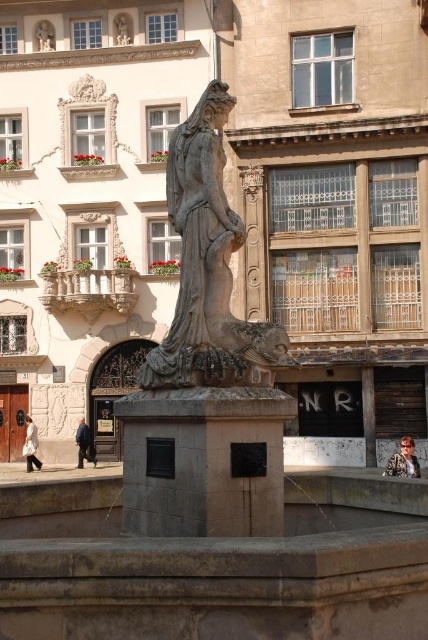
Question: Can you confirm if white fabric coat at lower left is thinner than dark blue jeans at lower left?

Choices:
 (A) yes
 (B) no

Answer: (A)

Question: Is bronze statue at center to the left of shiny brown hair at center from the viewer's perspective?

Choices:
 (A) yes
 (B) no

Answer: (A)

Question: Does bronze statue at center have a smaller size compared to dark blue jeans at lower left?

Choices:
 (A) no
 (B) yes

Answer: (A)

Question: Which of the following is the closest to the observer?

Choices:
 (A) (169, 173)
 (B) (95, 465)
 (C) (394, 465)
 (D) (26, 467)

Answer: (A)

Question: Estimate the real-world distances between objects in this image. Which object is closer to the shiny brown hair at center?

Choices:
 (A) dark blue jeans at lower left
 (B) white fabric coat at lower left

Answer: (A)

Question: Which point is closer to the camera taking this photo?

Choices:
 (A) (24, 440)
 (B) (85, 422)
 (C) (166, 358)

Answer: (C)